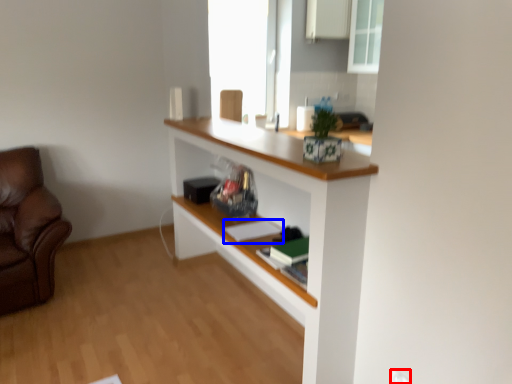
Question: Which point is further to the camera, electric outlet (highlighted by a red box) or book (highlighted by a blue box)?

Choices:
 (A) electric outlet
 (B) book

Answer: (B)